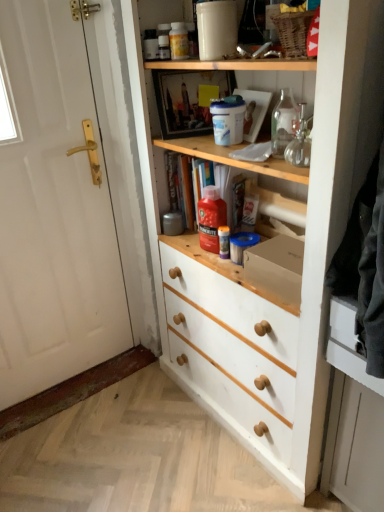
Question: Is white matte drawer at lower right facing towards red plastic bottle at center, the 1th bottle positioned from the right?

Choices:
 (A) yes
 (B) no

Answer: (B)

Question: Considering the relative sizes of white matte drawer at lower right and red plastic bottle at center, the 1th bottle positioned from the right, in the image provided, is white matte drawer at lower right bigger than red plastic bottle at center, the 1th bottle positioned from the right,?

Choices:
 (A) yes
 (B) no

Answer: (A)

Question: From a real-world perspective, is white matte drawer at lower right physically below red plastic bottle at center, placed as the second bottle when sorted from left to right?

Choices:
 (A) no
 (B) yes

Answer: (B)

Question: Considering the relative sizes of white matte drawer at lower right and red plastic bottle at center, marked as the second bottle in a top-to-bottom arrangement, in the image provided, is white matte drawer at lower right wider than red plastic bottle at center, marked as the second bottle in a top-to-bottom arrangement,?

Choices:
 (A) no
 (B) yes

Answer: (B)

Question: Would you consider white matte drawer at lower right to be distant from red plastic bottle at center, which is the 1th bottle from bottom to top?

Choices:
 (A) yes
 (B) no

Answer: (B)

Question: From a real-world perspective, is translucent plastic bottle at upper center, which is counted as the 2th bottle, starting from the right, above or below transparent glass bottle at upper right?

Choices:
 (A) below
 (B) above

Answer: (B)

Question: Relative to transparent glass bottle at upper right, is translucent plastic bottle at upper center, which is counted as the 2th bottle, starting from the right, in front or behind?

Choices:
 (A) front
 (B) behind

Answer: (B)

Question: Considering the positions of translucent plastic bottle at upper center, which is the 1th bottle from left to right, and transparent glass bottle at upper right in the image, is translucent plastic bottle at upper center, which is the 1th bottle from left to right, taller or shorter than transparent glass bottle at upper right?

Choices:
 (A) short
 (B) tall

Answer: (A)

Question: Considering the positions of point tap(173, 36) and point tap(292, 161), is point tap(173, 36) closer or farther from the camera than point tap(292, 161)?

Choices:
 (A) closer
 (B) farther

Answer: (B)

Question: Considering the positions of white matte door at left and white painted wood cupboard at center in the image, is white matte door at left bigger or smaller than white painted wood cupboard at center?

Choices:
 (A) small
 (B) big

Answer: (A)

Question: In the image, is white matte door at left positioned in front of or behind white painted wood cupboard at center?

Choices:
 (A) front
 (B) behind

Answer: (B)

Question: Considering the positions of point (49, 134) and point (291, 248), is point (49, 134) closer or farther from the camera than point (291, 248)?

Choices:
 (A) farther
 (B) closer

Answer: (A)

Question: In terms of width, does white matte door at left look wider or thinner when compared to white painted wood cupboard at center?

Choices:
 (A) wide
 (B) thin

Answer: (B)

Question: Relative to white matte drawer at lower right, is white painted wood cupboard at center in front or behind?

Choices:
 (A) behind
 (B) front

Answer: (B)

Question: Is white painted wood cupboard at center taller or shorter than white matte drawer at lower right?

Choices:
 (A) tall
 (B) short

Answer: (A)